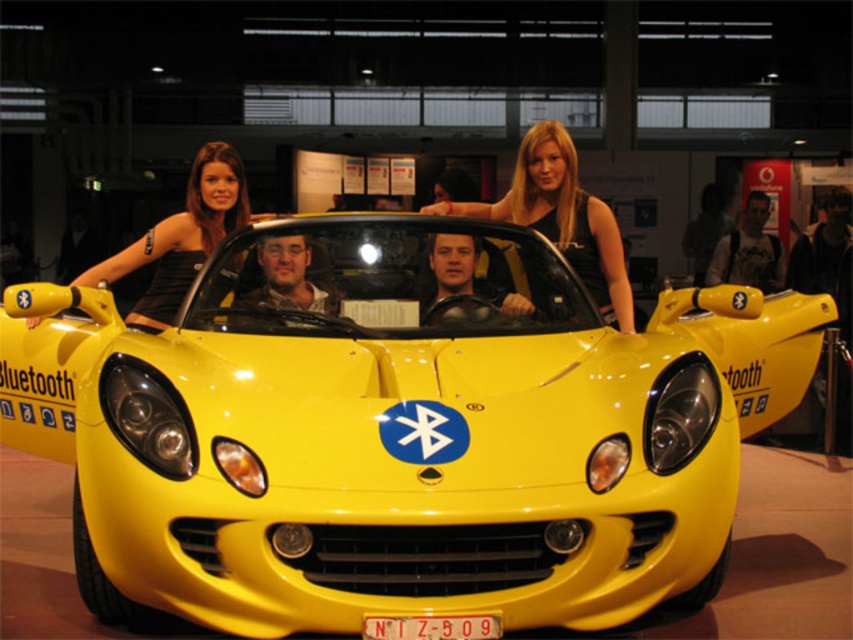
Can you confirm if black satin dress at upper left is positioned above yellow plastic license plate at center?

Indeed, black satin dress at upper left is positioned over yellow plastic license plate at center.

Who is lower down, black satin dress at upper left or yellow plastic license plate at center?

yellow plastic license plate at center

Locate an element on the screen. black satin dress at upper left is located at coordinates (181, 237).

The width and height of the screenshot is (853, 640). What are the coordinates of `black satin dress at upper left` in the screenshot? It's located at (181, 237).

Does yellow matte sports car at center appear on the left side of yellow plastic license plate at center?

Incorrect, yellow matte sports car at center is not on the left side of yellow plastic license plate at center.

Is yellow matte sports car at center in front of yellow plastic license plate at center?

No, yellow matte sports car at center is behind yellow plastic license plate at center.

The width and height of the screenshot is (853, 640). Identify the location of yellow matte sports car at center. (392, 432).

Does black fabric top at upper center appear over yellow plastic license plate at center?

Yes.

Find the location of a particular element. This screenshot has width=853, height=640. black fabric top at upper center is located at coordinates (561, 218).

Between point (560, 128) and point (467, 636), which one is positioned behind?

The point (560, 128) is behind.

Find the location of `black fabric top at upper center`. black fabric top at upper center is located at coordinates (561, 218).